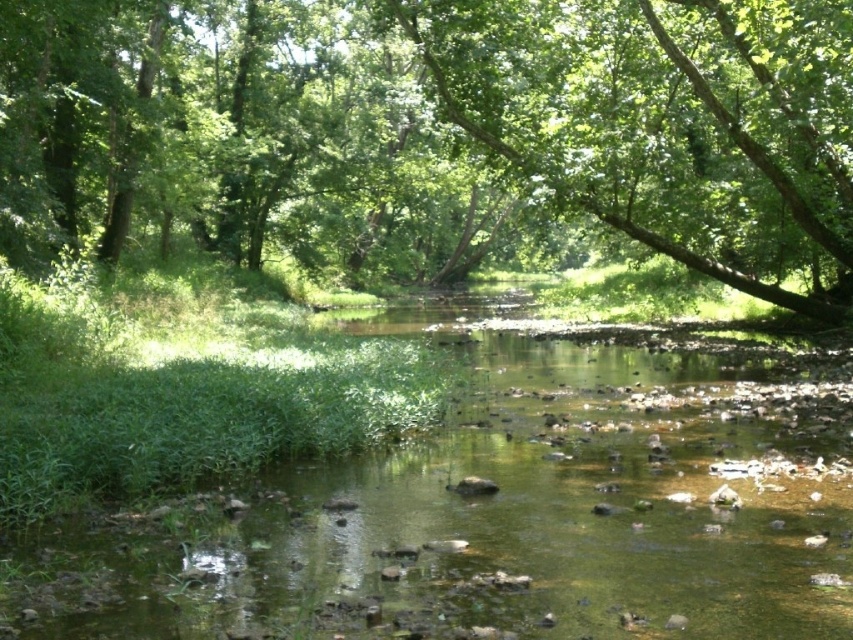
Question: Which of the following is the farthest from the observer?

Choices:
 (A) clear water at center
 (B) green leafy tree at center

Answer: (B)

Question: Considering the relative positions of green leafy tree at center and clear water at center in the image provided, where is green leafy tree at center located with respect to clear water at center?

Choices:
 (A) above
 (B) below

Answer: (A)

Question: Among these objects, which one is nearest to the camera?

Choices:
 (A) green leafy tree at center
 (B) clear water at center

Answer: (B)

Question: Is green leafy tree at center in front of clear water at center?

Choices:
 (A) yes
 (B) no

Answer: (B)

Question: Is green leafy tree at center in front of clear water at center?

Choices:
 (A) yes
 (B) no

Answer: (B)